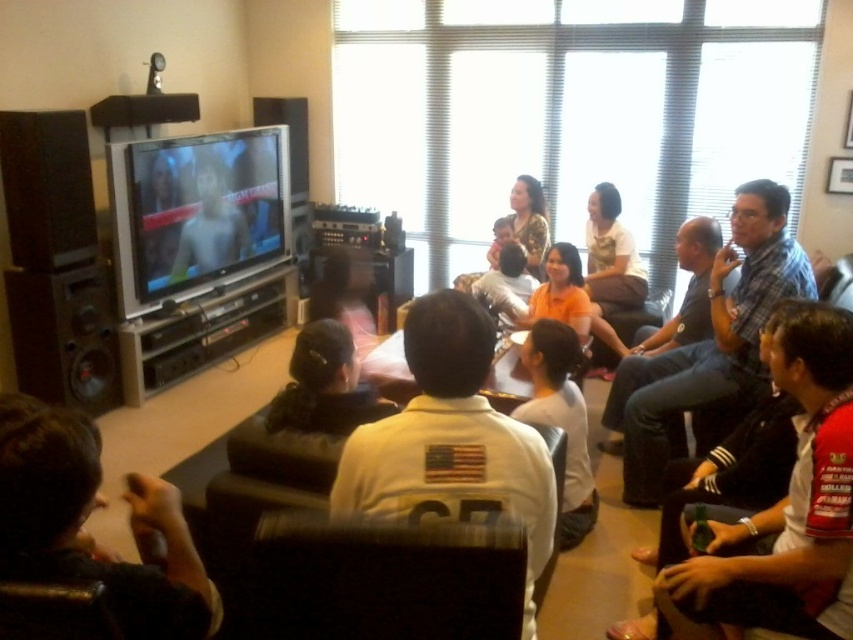
Which is more to the left, dark brown leather chair at lower left or smooth skin face at center?

Positioned to the left is smooth skin face at center.

The image size is (853, 640). In order to click on dark brown leather chair at lower left in this screenshot , I will do `click(85, 518)`.

Is point (132, 636) positioned behind point (202, 173)?

No, (132, 636) is closer to viewer.

Image resolution: width=853 pixels, height=640 pixels. Identify the location of dark brown leather chair at lower left. (85, 518).

Is white matte shirt at center wider than smooth skin face at center?

Yes.

Can you confirm if white matte shirt at center is shorter than smooth skin face at center?

In fact, white matte shirt at center may be taller than smooth skin face at center.

Does point (585, 433) lie behind point (170, 269)?

No, it is not.

You are a GUI agent. You are given a task and a screenshot of the screen. Output one action in this format:
    pyautogui.click(x=<x>, y=<y>)
    Task: Click on the white matte shirt at center
    The width and height of the screenshot is (853, 640).
    Given the screenshot: What is the action you would take?
    pyautogui.click(x=561, y=420)

In the scene shown: Does white jersey at center appear on the right side of shiny silver television at center left?

Yes, white jersey at center is to the right of shiny silver television at center left.

Who is higher up, white jersey at center or shiny silver television at center left?

shiny silver television at center left

You are a GUI agent. You are given a task and a screenshot of the screen. Output one action in this format:
    pyautogui.click(x=<x>, y=<y>)
    Task: Click on the white jersey at center
    
    Given the screenshot: What is the action you would take?
    pyautogui.click(x=451, y=438)